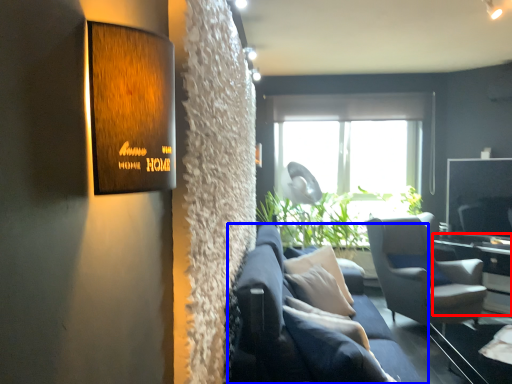
Question: Among these objects, which one is nearest to the camera, table (highlighted by a red box) or studio couch (highlighted by a blue box)?

Choices:
 (A) table
 (B) studio couch

Answer: (B)